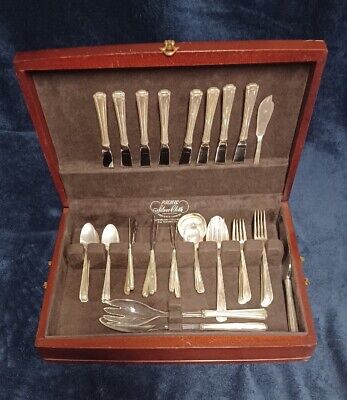
At what (x,y) coordinates should I click in order to perform the action: click on spoons. Please return your answer as a coordinate pair (x, y). Looking at the image, I should click on (85, 237), (112, 236), (192, 232), (228, 233).